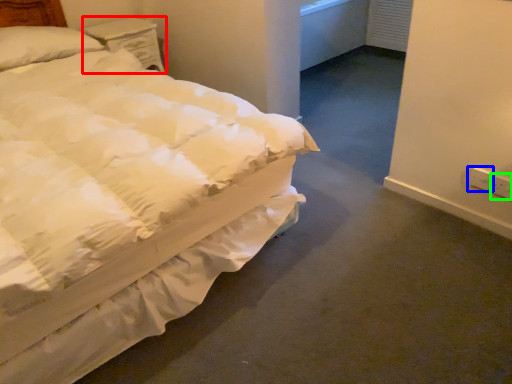
Question: Estimate the real-world distances between objects in this image. Which object is farther from nightstand (highlighted by a red box), electric outlet (highlighted by a blue box) or electric outlet (highlighted by a green box)?

Choices:
 (A) electric outlet
 (B) electric outlet

Answer: (B)